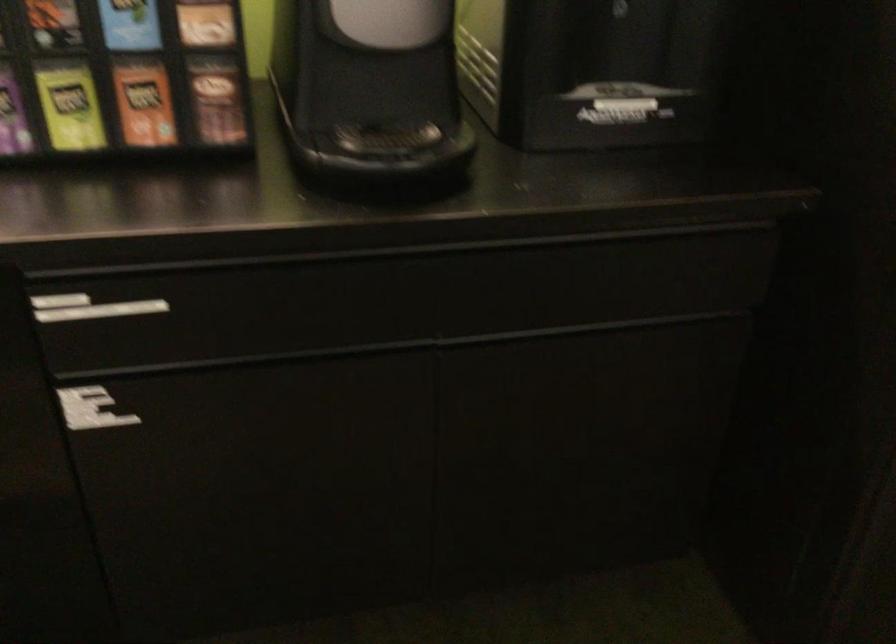
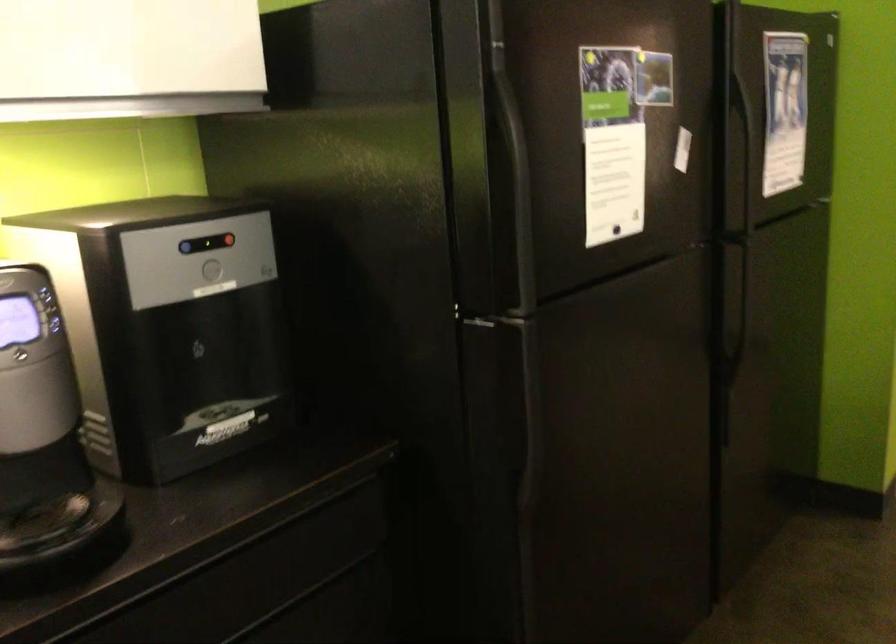
Question: The first image is from the beginning of the video and the second image is from the end. How did the camera likely rotate when shooting the video?

Choices:
 (A) Left
 (B) Right
 (C) Up
 (D) Down

Answer: (B)